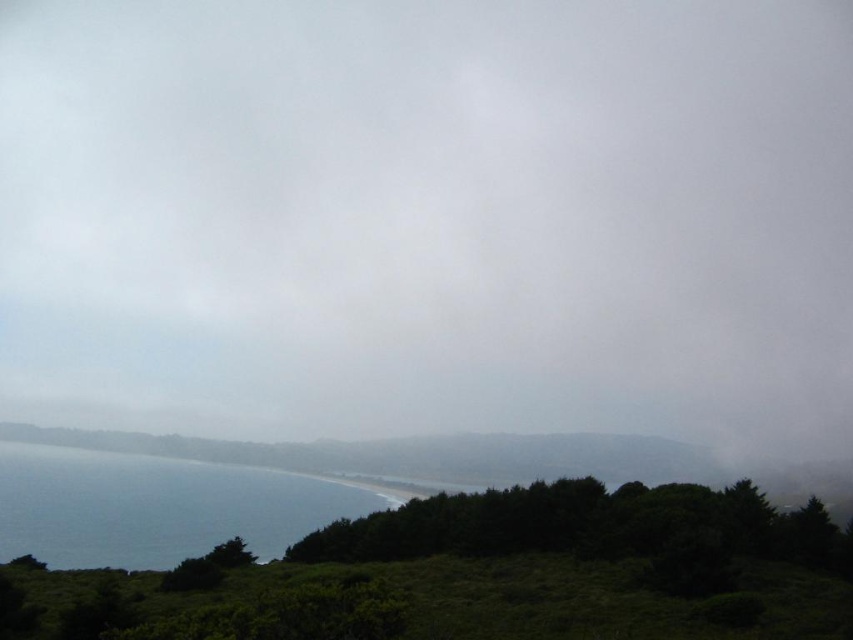
You are a bird soaring in the sky and want to land on the white fluffy cloud at upper center. Given that your wingspan is 1.5 meters, can you safely land on it?

The distance between you and the white fluffy cloud at upper center is 238.86 meters, so you can safely land on it as the distance is not related to your wingspan.

You are a photographer trying to capture the entire scene in one shot. Given that your camera can only focus on one object at a time, which object between the white fluffy cloud at upper center and the blue water at lower left should you prioritize focusing on to ensure it appears sharp in the photo?

The white fluffy cloud at upper center should be prioritized for focus because it is larger in size compared to the blue water at lower left, making it a more prominent subject in the composition.

You are a weather observer analyzing the coastal landscape image. You notice the white fluffy cloud at upper center. Based on its position, can you determine if it is closer to the top or the bottom of the image?

The white fluffy cloud at upper center is located at point 0.341 on the vertical axis, which places it closer to the bottom of the image since 0.341 is less than 0.5. Therefore, it is closer to the bottom.